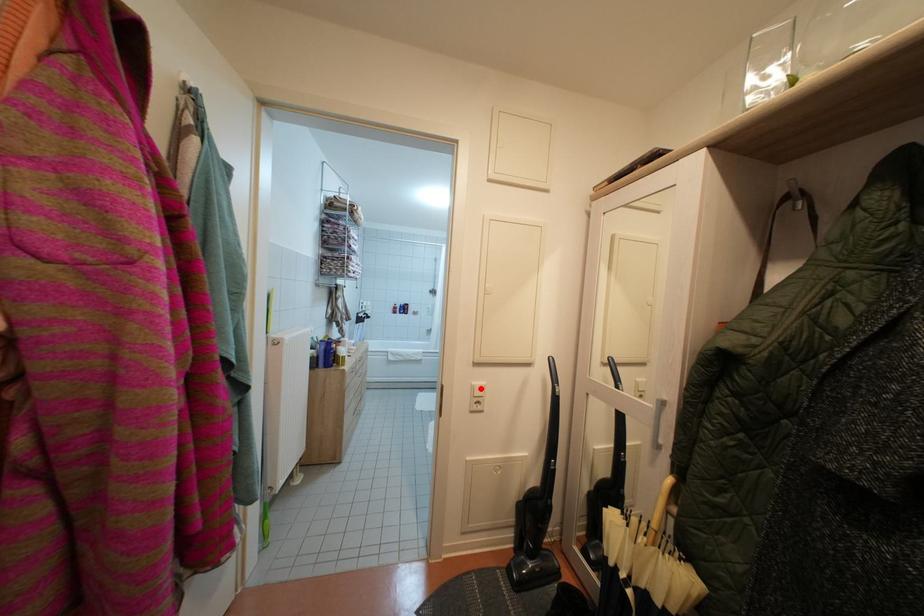
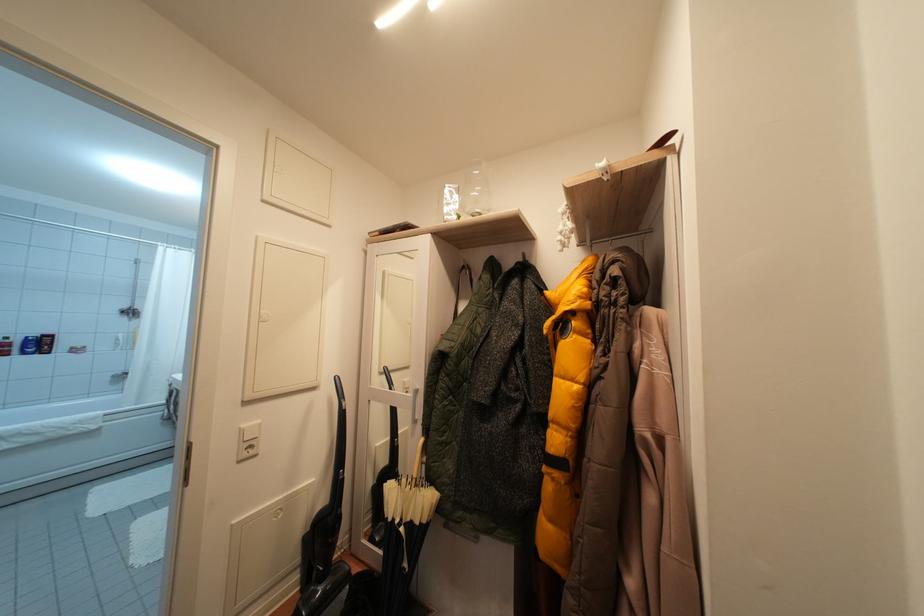
Question: I am providing you with two images of the same scene from different viewpoints. A red point is marked on the first image. At the location where the point appears in image 1, is it still visible in image 2?

Choices:
 (A) Yes
 (B) No

Answer: (A)